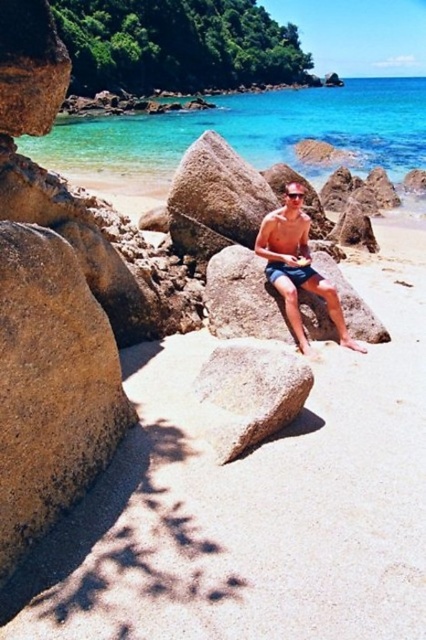
Which is behind, point (52, 440) or point (293, 198)?

Point (293, 198)

Is point (11, 346) farther from camera compared to point (287, 189)?

No, it is in front of (287, 189).

Who is more forward, (x=60, y=285) or (x=288, y=193)?

Point (x=60, y=285)

Find the location of a particular element. brown rough rock at left is located at coordinates (51, 387).

Which is more to the left, gray rough rock at center or smooth brown rock at center?

smooth brown rock at center

Is gray rough rock at center to the left of smooth brown rock at center from the viewer's perspective?

No, gray rough rock at center is not to the left of smooth brown rock at center.

Image resolution: width=426 pixels, height=640 pixels. I want to click on gray rough rock at center, so click(x=247, y=394).

The image size is (426, 640). Find the location of `gray rough rock at center`. gray rough rock at center is located at coordinates (247, 394).

Who is taller, clear blue water at upper center or smooth brown rock at center?

Standing taller between the two is clear blue water at upper center.

Between clear blue water at upper center and smooth brown rock at center, which one appears on the right side from the viewer's perspective?

From the viewer's perspective, clear blue water at upper center appears more on the right side.

Does point (52, 161) lie behind point (176, 195)?

Yes.

At what (x,y) coordinates should I click in order to perform the action: click on clear blue water at upper center. Please return your answer as a coordinate pair (x, y). The image size is (426, 640). Looking at the image, I should click on (x=253, y=132).